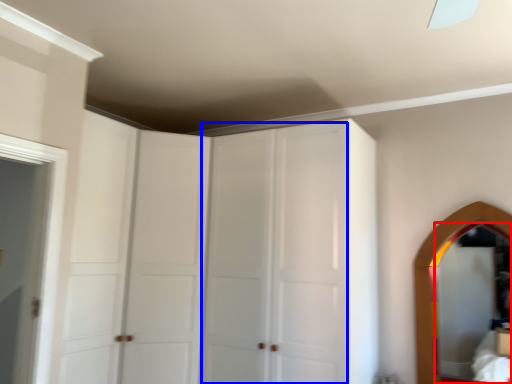
Question: Which point is further to the camera, mirror (highlighted by a red box) or glass door (highlighted by a blue box)?

Choices:
 (A) mirror
 (B) glass door

Answer: (A)